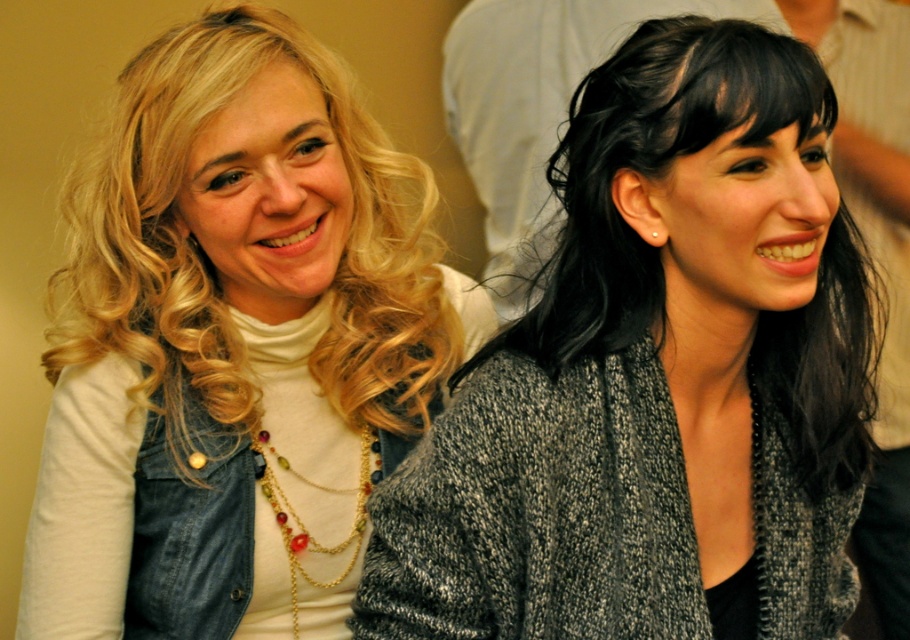
You are a photographer taking a portrait of two women. You notice the gray knitted sweater at center and the blonde curly hair at left. Which object is located to the right of the other?

The gray knitted sweater at center is positioned on the right side of blonde curly hair at left, so the gray knitted sweater at center is to the right of the blonde curly hair at left.

You are taking a photo of two women and need to ensure their clothing details are clear. The scene shows a gray knitted sweater at center and blonde curly hair at left. Which clothing item is positioned lower in the image?

The gray knitted sweater at center is located below the blonde curly hair at left, so the gray knitted sweater at center is positioned lower in the image.